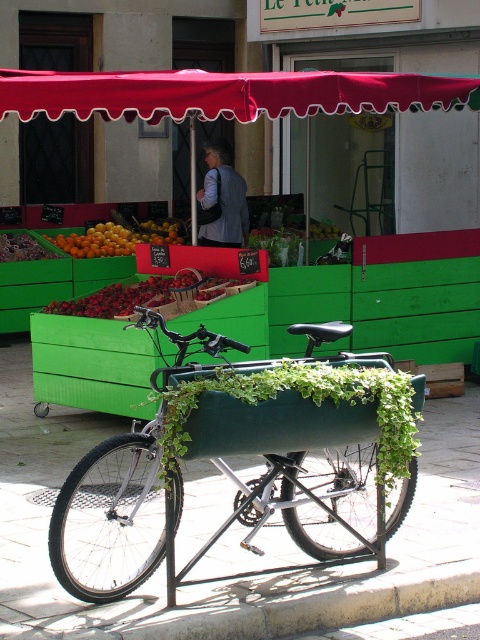
Who is more forward, (95, 298) or (73, 237)?

Point (95, 298)

Does point (186, 289) lie in front of point (116, 232)?

Yes.

The image size is (480, 640). What are the coordinates of `shiny red strawberries at center` in the screenshot? It's located at (137, 296).

Between green matte bicycle at center and red fabric canopy at upper center, which one appears on the right side from the viewer's perspective?

From the viewer's perspective, red fabric canopy at upper center appears more on the right side.

Is point (180, 387) farther from camera compared to point (32, 99)?

That is False.

Is point (374, 481) more distant than point (132, 100)?

No.

Identify the location of green matte bicycle at center. (244, 452).

What do you see at coordinates (244, 452) in the screenshot? I see `green matte bicycle at center` at bounding box center [244, 452].

Where is `green matte bicycle at center`? This screenshot has height=640, width=480. green matte bicycle at center is located at coordinates click(x=244, y=452).